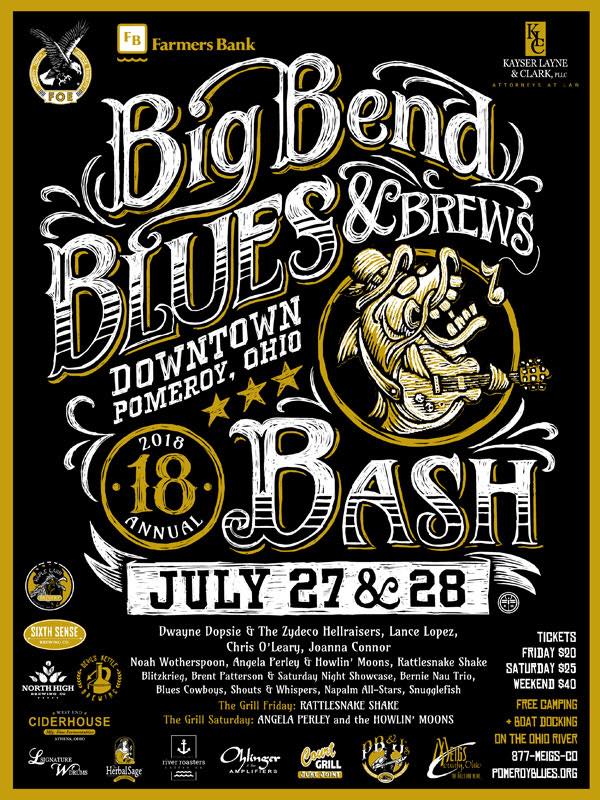
This screenshot has height=800, width=600. Identify the location of poster. (225, 522).